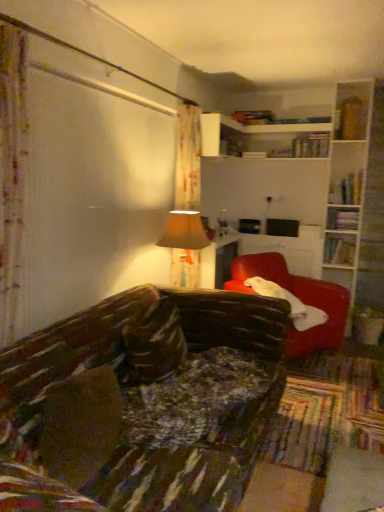
Question: Is beige fabric lampshade at center surrounded by hardcover book at upper right, arranged as the third book when viewed from the top?

Choices:
 (A) yes
 (B) no

Answer: (B)

Question: From the image's perspective, is hardcover book at upper right, the 2th book positioned from the bottom, below beige fabric lampshade at center?

Choices:
 (A) no
 (B) yes

Answer: (A)

Question: Can you confirm if hardcover book at upper right, the 2th book positioned from the bottom, is thinner than beige fabric lampshade at center?

Choices:
 (A) no
 (B) yes

Answer: (B)

Question: Can you confirm if hardcover book at upper right, arranged as the third book when viewed from the top, is bigger than beige fabric lampshade at center?

Choices:
 (A) yes
 (B) no

Answer: (B)

Question: Is hardcover book at upper right, the 2th book positioned from the bottom, far from beige fabric lampshade at center?

Choices:
 (A) yes
 (B) no

Answer: (A)

Question: Is point (195, 282) closer or farther from the camera than point (349, 216)?

Choices:
 (A) farther
 (B) closer

Answer: (B)

Question: From the image's perspective, is beige fabric lampshade at center located above or below hardcover book at upper right, the 3th book in the right-to-left sequence?

Choices:
 (A) below
 (B) above

Answer: (A)

Question: In terms of height, does beige fabric lampshade at center look taller or shorter compared to hardcover book at upper right, the 3th book in the right-to-left sequence?

Choices:
 (A) tall
 (B) short

Answer: (A)

Question: Relative to hardcover book at upper right, arranged as the third book when viewed from the top, is beige fabric lampshade at center in front or behind?

Choices:
 (A) behind
 (B) front

Answer: (B)

Question: Is point (319, 307) positioned closer to the camera than point (336, 184)?

Choices:
 (A) farther
 (B) closer

Answer: (B)

Question: Based on their positions, is matte red armchair at right located to the left or right of hardcover books at upper right, arranged as the third book when ordered from the bottom?

Choices:
 (A) left
 (B) right

Answer: (A)

Question: From a real-world perspective, is matte red armchair at right physically located above or below hardcover books at upper right, positioned as the 1th book in right-to-left order?

Choices:
 (A) below
 (B) above

Answer: (A)

Question: Choose the correct answer: Is matte red armchair at right inside hardcover books at upper right, acting as the 2th book starting from the top, or outside it?

Choices:
 (A) inside
 (B) outside

Answer: (B)

Question: From a real-world perspective, is hardcover book at upper right, the first book positioned from the bottom, physically located above or below matte red armchair at right?

Choices:
 (A) above
 (B) below

Answer: (A)

Question: In terms of height, does hardcover book at upper right, the first book positioned from the bottom, look taller or shorter compared to matte red armchair at right?

Choices:
 (A) short
 (B) tall

Answer: (A)